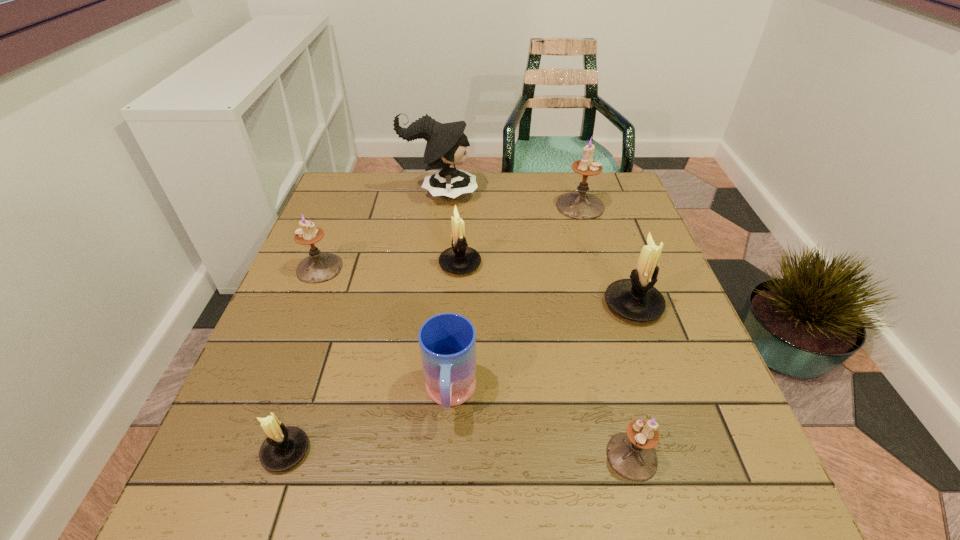
The image size is (960, 540). Find the location of `doll`. doll is located at coordinates (446, 145).

This screenshot has height=540, width=960. I want to click on the biggest purple candle holder, so click(580, 205).

Identify the location of the farthest candle holder. (580, 205).

The image size is (960, 540). What are the coordinates of `the second nearest white candle holder` in the screenshot? It's located at (635, 299).

I want to click on the third nearest candle holder, so click(635, 299).

Find the location of a particular element. the second farthest purple candle holder is located at coordinates (318, 267).

Identify the location of the leftmost purple candle holder. (318, 267).

Where is `the second smallest white candle holder`? Image resolution: width=960 pixels, height=540 pixels. the second smallest white candle holder is located at coordinates (459, 259).

You are a GUI agent. You are given a task and a screenshot of the screen. Output one action in this format:
    pyautogui.click(x=<x>, y=<y>)
    Task: Click on the farthest white candle holder
    This screenshot has width=960, height=540.
    Given the screenshot: What is the action you would take?
    pyautogui.click(x=459, y=259)

Where is `mug`? The height and width of the screenshot is (540, 960). mug is located at coordinates (447, 341).